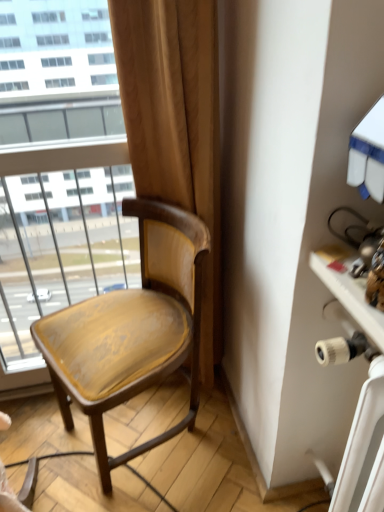
In order to face white plastic table at right, should I rotate leftwards or rightwards?

A 20.326 degree turn to the right will do.

Locate an element on the screen. The height and width of the screenshot is (512, 384). white plastic table at right is located at coordinates (361, 389).

What is the approximate height of white plastic table at right?

The height of white plastic table at right is 23.26 inches.

Describe the element at coordinates (361, 389) in the screenshot. I see `white plastic table at right` at that location.

I want to click on wooden chair at center, so click(132, 329).

The width and height of the screenshot is (384, 512). What do you see at coordinates (132, 329) in the screenshot?
I see `wooden chair at center` at bounding box center [132, 329].

Where is `white plastic table at right`? Image resolution: width=384 pixels, height=512 pixels. white plastic table at right is located at coordinates (361, 389).

Does white plastic table at right appear on the right side of wooden chair at center?

Yes, white plastic table at right is to the right of wooden chair at center.

Is white plastic table at right in front of or behind wooden chair at center in the image?

Clearly, white plastic table at right is in front of wooden chair at center.

Between point (360, 410) and point (120, 293), which one is positioned behind?

Point (120, 293)

From the image's perspective, which object appears higher, white plastic table at right or wooden chair at center?

From the image's view, wooden chair at center is above.

From a real-world perspective, is white plastic table at right positioned above or below wooden chair at center?

Clearly, from a real-world perspective, white plastic table at right is above wooden chair at center.

Is white plastic table at right wider or thinner than wooden chair at center?

Clearly, white plastic table at right has less width compared to wooden chair at center.

Considering the relative sizes of white plastic table at right and wooden chair at center in the image provided, is white plastic table at right taller than wooden chair at center?

Incorrect, the height of white plastic table at right is not larger of that of wooden chair at center.

Does white plastic table at right have a smaller size compared to wooden chair at center?

Yes.

Can wooden chair at center be found inside white plastic table at right?

Definitely not — wooden chair at center is not inside white plastic table at right.

Is white plastic table at right with wooden chair at center?

white plastic table at right and wooden chair at center are not in contact.

Based on the photo, is white plastic table at right turned away from wooden chair at center?

No.

At what (x,y) coordinates should I click in order to perform the action: click on table below the wooden chair at center (from the image's perspective). Please return your answer as a coordinate pair (x, y). Looking at the image, I should click on (361, 389).

Considering the relative positions of wooden chair at center and white plastic table at right in the image provided, is wooden chair at center to the right of white plastic table at right from the viewer's perspective?

No.

Is wooden chair at center closer to the viewer compared to white plastic table at right?

That is False.

Which point is more forward, (58,373) or (365,353)?

The point (365,353) is closer.

From the image's perspective, is wooden chair at center positioned above or below white plastic table at right?

From the image's perspective, wooden chair at center appears above white plastic table at right.

From a real-world perspective, is wooden chair at center physically above white plastic table at right?

Incorrect, from a real-world perspective, wooden chair at center is lower than white plastic table at right.

Is wooden chair at center thinner than white plastic table at right?

No.

From their relative heights in the image, would you say wooden chair at center is taller or shorter than white plastic table at right?

Considering their sizes, wooden chair at center has more height than white plastic table at right.

Which of these two, wooden chair at center or white plastic table at right, is smaller?

Smaller between the two is white plastic table at right.

Is wooden chair at center outside of white plastic table at right?

Yes, wooden chair at center is not within white plastic table at right.

Is wooden chair at center far away from white plastic table at right?

No, there isn't a large distance between wooden chair at center and white plastic table at right.

Is wooden chair at center turned away from white plastic table at right?

No.

How many degrees apart are the facing directions of wooden chair at center and white plastic table at right?

The angular difference between wooden chair at center and white plastic table at right is 30.8 degrees.

How distant is wooden chair at center from white plastic table at right?

21.86 inches.

Image resolution: width=384 pixels, height=512 pixels. I want to click on table in front of the wooden chair at center, so click(361, 389).

Where is `chair on the left of the white plastic table at right`? chair on the left of the white plastic table at right is located at coordinates (132, 329).

In order to click on table on the right of wooden chair at center in this screenshot , I will do tap(361, 389).